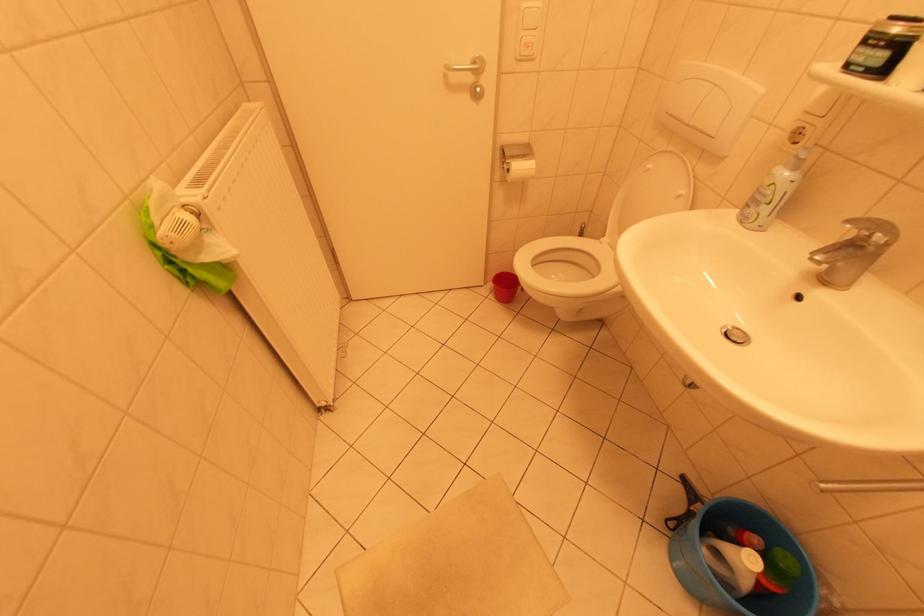
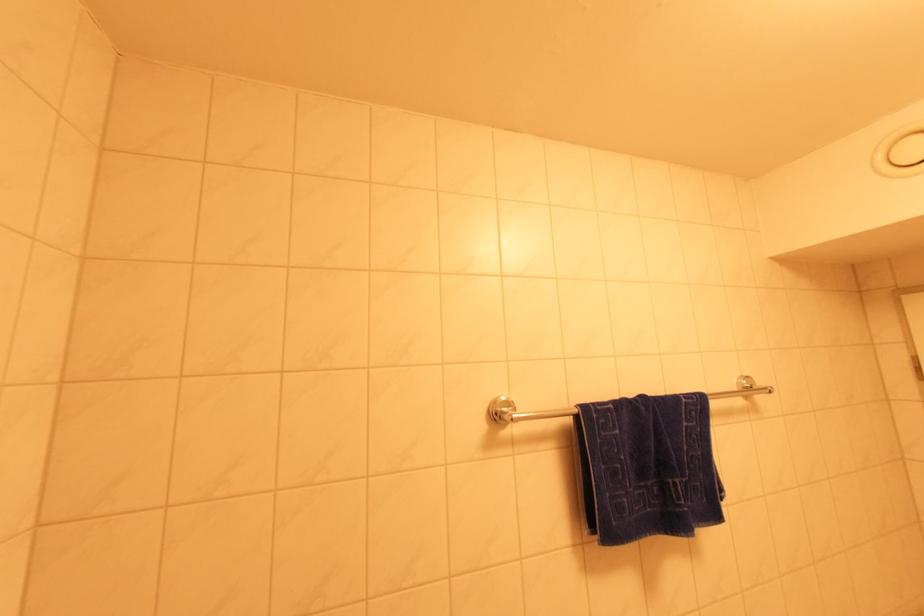
Question: The camera is either moving clockwise (left) or counter-clockwise (right) around the object. The first image is from the beginning of the video and the second image is from the end. Is the camera moving left or right when shooting the video?

Choices:
 (A) Left
 (B) Right

Answer: (B)